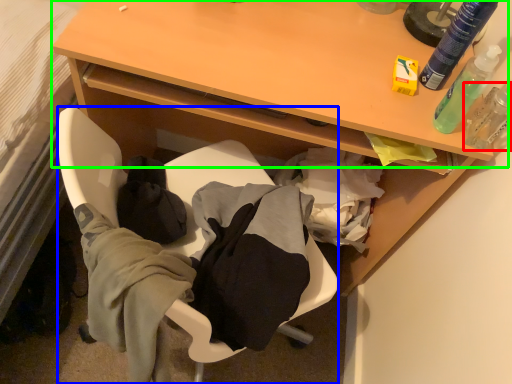
Question: Which is nearer to the toiletry (highlighted by a red box)? chair (highlighted by a blue box) or table (highlighted by a green box).

Choices:
 (A) chair
 (B) table

Answer: (B)